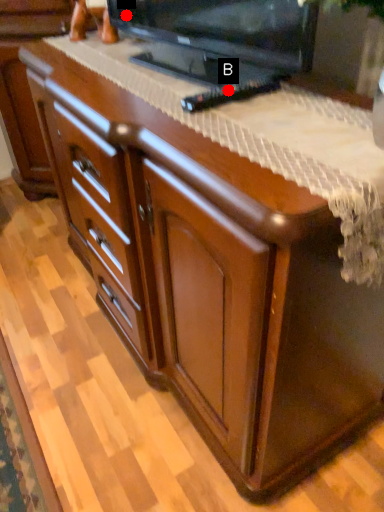
Question: Two points are circled on the image, labeled by A and B beside each circle. Which point appears farthest from the camera in this image?

Choices:
 (A) A is further
 (B) B is further

Answer: (A)